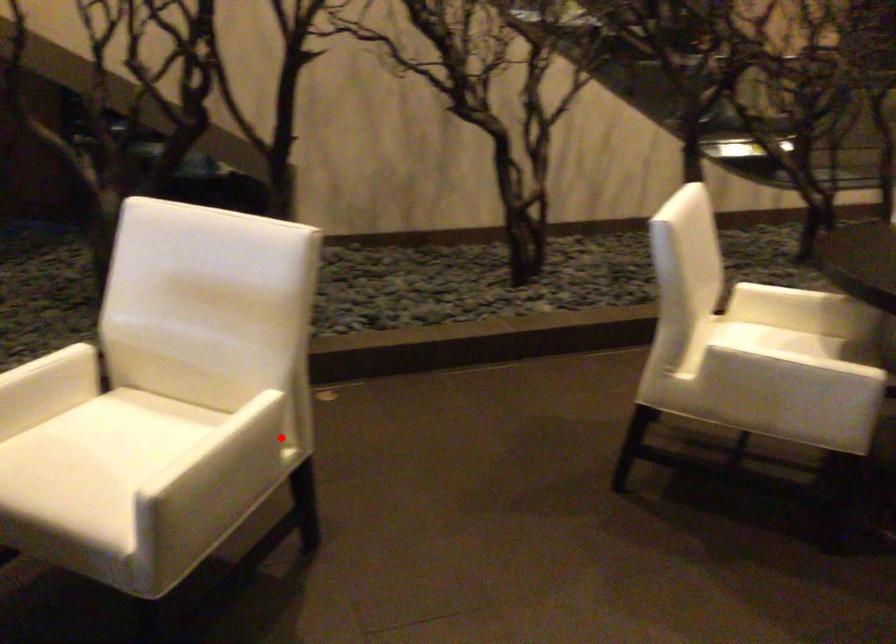
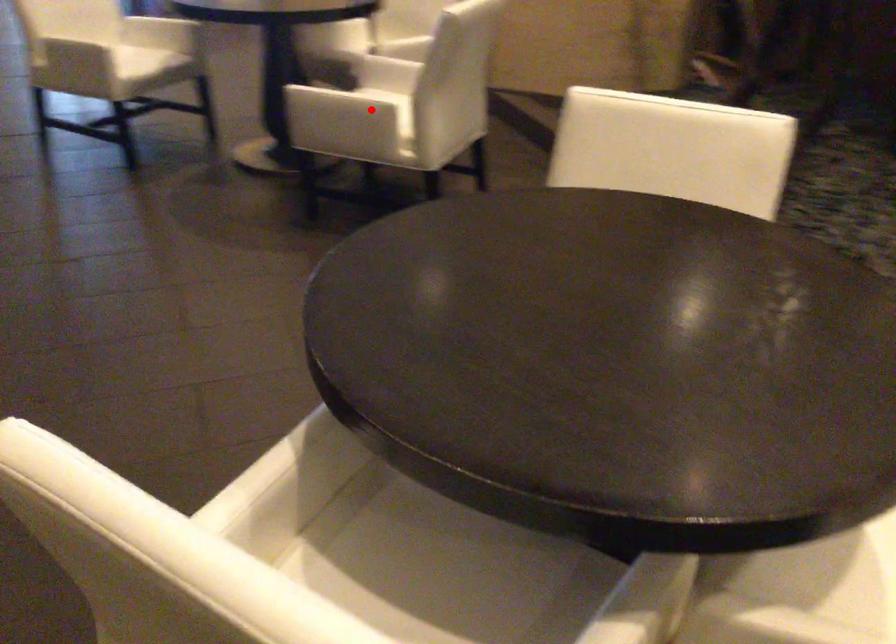
I am providing you with two images of the same scene from different viewpoints. A red point is marked on the first image and another point is marked on the second image. Is the marked point in image1 the same physical position as the marked point in image2?

Yes